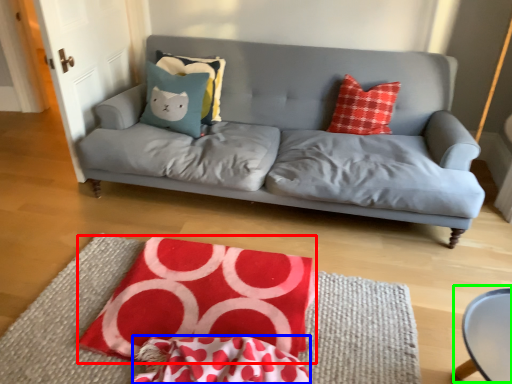
Question: Which object is positioned closest to quilt (highlighted by a red box)? Select from material (highlighted by a blue box) and round table (highlighted by a green box).

Choices:
 (A) material
 (B) round table

Answer: (A)